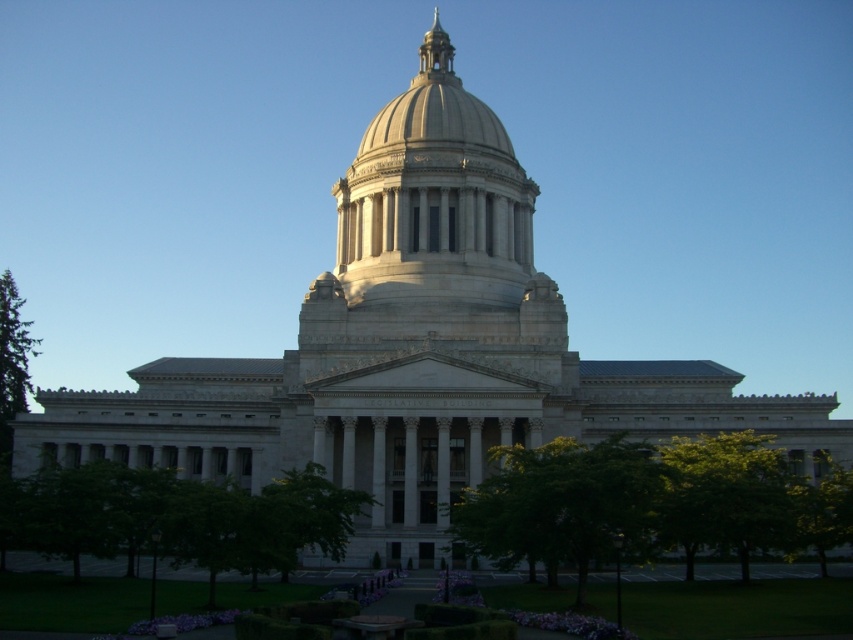
You are standing at the entrance of the grand neoclassical building and see two points marked on the plaza in front of you. The first point is labeled as point (271, 518) and the second is point (612, 548). Which point is closer to the building?

Point (271, 518) is behind point (612, 548), so the point closer to the building is point (612, 548).

You are a visitor standing in front of the grand neoclassical building. You notice two green leafy trees in the scene. Which tree, the green leafy tree at lower left or the green leafy tree at center, is larger in size?

The green leafy tree at lower left is bigger than the green leafy tree at center.